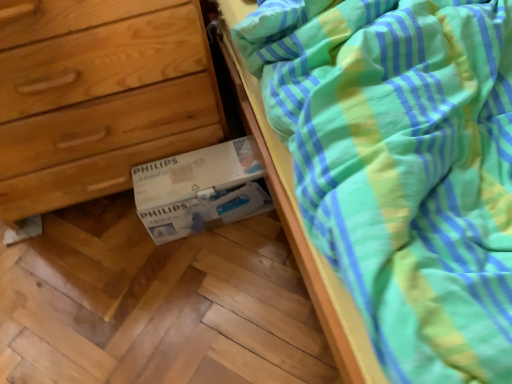
Question: Should I look upward or downward to see wooden chest of drawers at lower left?

Choices:
 (A) up
 (B) down

Answer: (A)

Question: Should I look upward or downward to see white cardboard box at lower center?

Choices:
 (A) up
 (B) down

Answer: (A)

Question: Does wooden chest of drawers at lower left have a lesser width compared to white cardboard box at lower center?

Choices:
 (A) yes
 (B) no

Answer: (B)

Question: Would you say wooden chest of drawers at lower left contains white cardboard box at lower center?

Choices:
 (A) yes
 (B) no

Answer: (B)

Question: From a real-world perspective, is wooden chest of drawers at lower left on top of white cardboard box at lower center?

Choices:
 (A) no
 (B) yes

Answer: (B)

Question: Can you confirm if wooden chest of drawers at lower left is positioned to the right of white cardboard box at lower center?

Choices:
 (A) no
 (B) yes

Answer: (A)

Question: Is wooden chest of drawers at lower left shorter than white cardboard box at lower center?

Choices:
 (A) yes
 (B) no

Answer: (B)

Question: From the image's perspective, is wooden chest of drawers at lower left on top of white cardboard box at lower center?

Choices:
 (A) no
 (B) yes

Answer: (B)

Question: Can you confirm if white cardboard box at lower center is wider than wooden chest of drawers at lower left?

Choices:
 (A) no
 (B) yes

Answer: (A)

Question: Can you confirm if white cardboard box at lower center is thinner than wooden chest of drawers at lower left?

Choices:
 (A) no
 (B) yes

Answer: (B)

Question: Is wooden chest of drawers at lower left inside white cardboard box at lower center?

Choices:
 (A) no
 (B) yes

Answer: (A)

Question: Does white cardboard box at lower center have a smaller size compared to wooden chest of drawers at lower left?

Choices:
 (A) yes
 (B) no

Answer: (A)

Question: Is white cardboard box at lower center facing away from wooden chest of drawers at lower left?

Choices:
 (A) no
 (B) yes

Answer: (B)

Question: From a real-world perspective, is white cardboard box at lower center positioned under wooden chest of drawers at lower left based on gravity?

Choices:
 (A) no
 (B) yes

Answer: (B)

Question: In terms of width, does white cardboard box at lower center look wider or thinner when compared to wooden chest of drawers at lower left?

Choices:
 (A) thin
 (B) wide

Answer: (A)